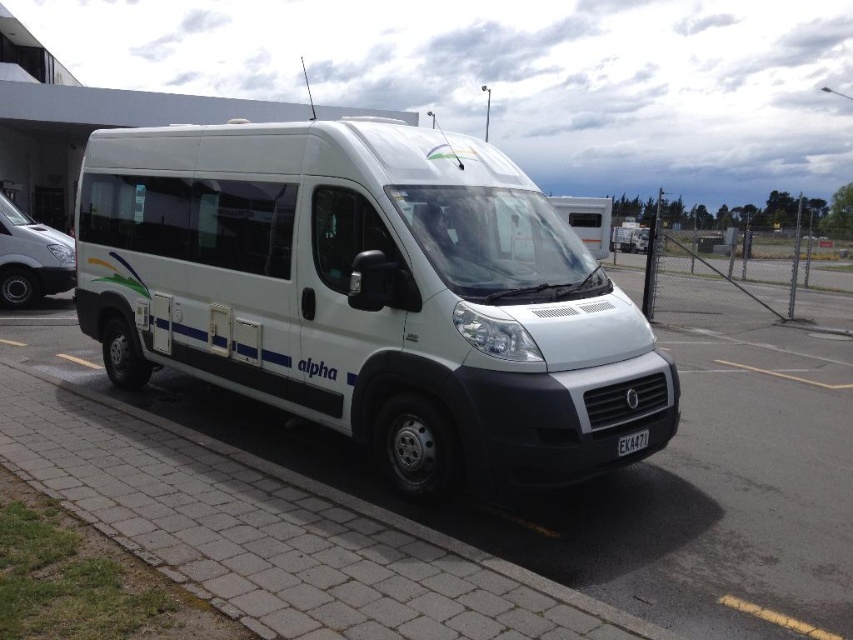
You are a delivery person who needs to park your van in the parking lot. The parking spot has a white brick pavement at center and a silver metallic van at left. Which area is larger for parking your vehicle?

The white brick pavement at center is bigger than the silver metallic van at left, so the parking spot with the white brick pavement at center is larger and more suitable for parking your vehicle.

You are standing in front of the van and want to locate two points marked in the image. Which of the two points, point (850, 296) or point (33, 232), is closer to you?

Point (33, 232) is closer to you because it is less further to the camera than point (850, 296).